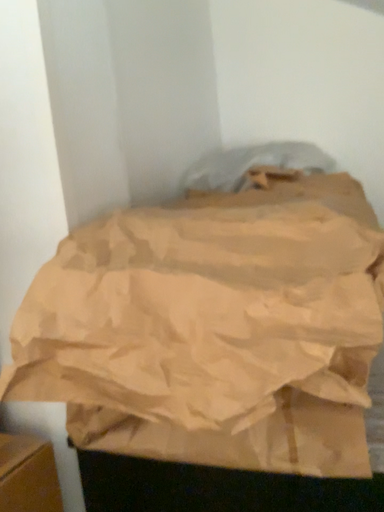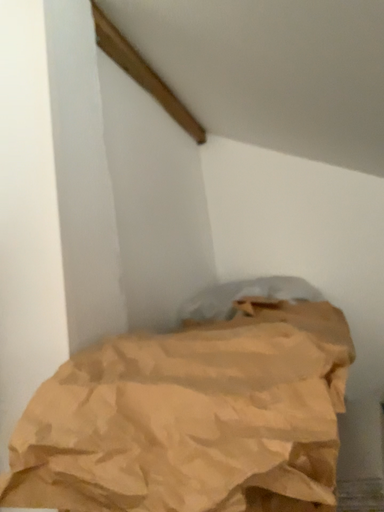
Question: How did the camera likely rotate when shooting the video?

Choices:
 (A) rotated downward
 (B) rotated upward

Answer: (B)